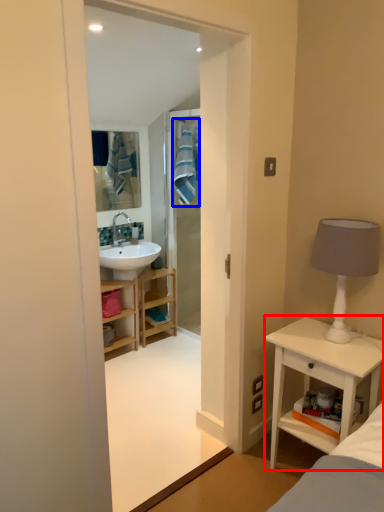
Question: Which of the following is the farthest to the observer, nightstand (highlighted by a red box) or bath towel (highlighted by a blue box)?

Choices:
 (A) nightstand
 (B) bath towel

Answer: (B)